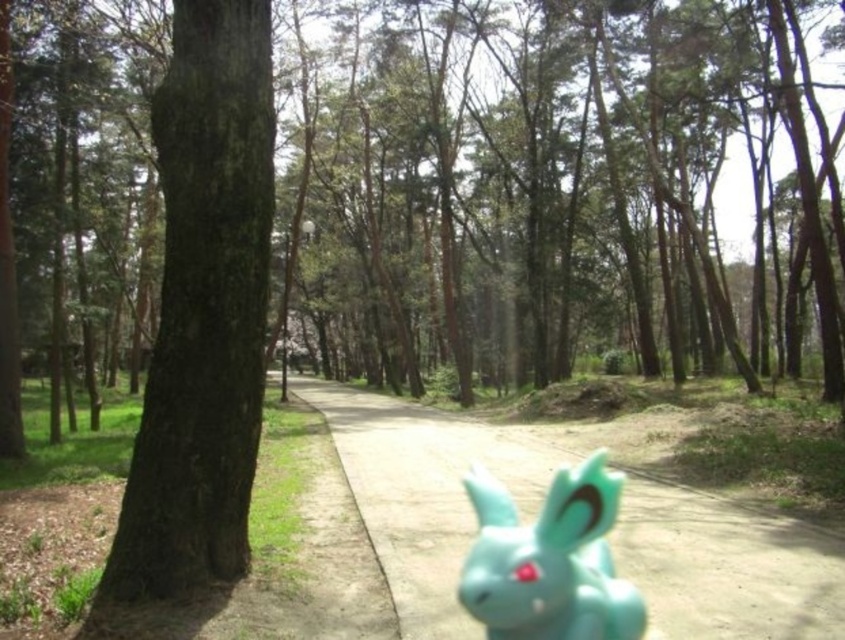
Question: Does dark brown bark tree at left have a smaller size compared to smooth concrete pavement at center?

Choices:
 (A) no
 (B) yes

Answer: (B)

Question: Which object is farther from the camera taking this photo?

Choices:
 (A) smooth concrete pavement at center
 (B) teal matte bunny at center
 (C) dark brown bark tree at left

Answer: (C)

Question: Can you confirm if dark brown bark tree at left is wider than teal matte bunny at center?

Choices:
 (A) yes
 (B) no

Answer: (A)

Question: Can you confirm if dark brown bark tree at left is wider than teal matte bunny at center?

Choices:
 (A) no
 (B) yes

Answer: (B)

Question: Which point is closer to the camera?

Choices:
 (A) dark brown bark tree at left
 (B) teal matte bunny at center

Answer: (B)

Question: Among these points, which one is farthest from the camera?

Choices:
 (A) (532, 557)
 (B) (456, 634)
 (C) (187, 493)

Answer: (C)